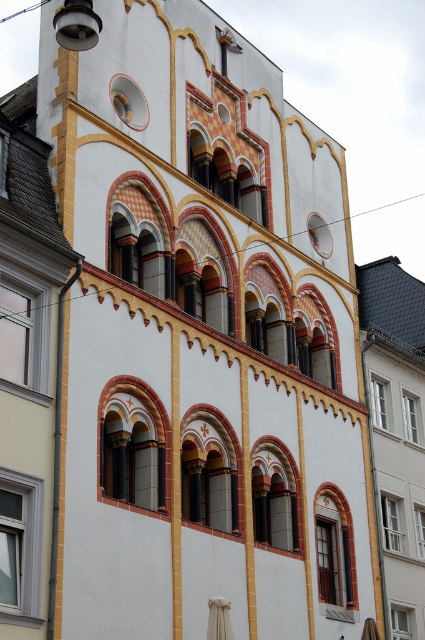
Is matte yellow window at center taller than white glass window at center?

Indeed, matte yellow window at center has a greater height compared to white glass window at center.

Is matte yellow window at center behind white glass window at center?

No, it is in front of white glass window at center.

Which is behind, point (294, 476) or point (416, 436)?

The point (416, 436) is behind.

Locate an element on the screen. The width and height of the screenshot is (425, 640). matte yellow window at center is located at coordinates (274, 497).

Between point (413, 417) and point (422, 513), which one is positioned in front?

Point (422, 513) is in front.

Who is shorter, white glass window at center or clear glass window at center?

clear glass window at center is shorter.

Does point (405, 396) come closer to viewer compared to point (424, 547)?

No, it is behind (424, 547).

What are the coordinates of `white glass window at center` in the screenshot? It's located at pyautogui.click(x=410, y=416).

Which is more to the right, matte red glass window at center or clear glass window at lower right?

Positioned to the right is clear glass window at lower right.

You are a GUI agent. You are given a task and a screenshot of the screen. Output one action in this format:
    pyautogui.click(x=<x>, y=<y>)
    Task: Click on the matte red glass window at center
    The width and height of the screenshot is (425, 640).
    Given the screenshot: What is the action you would take?
    pyautogui.click(x=334, y=552)

The width and height of the screenshot is (425, 640). What are the coordinates of `matte red glass window at center` in the screenshot? It's located at (334, 552).